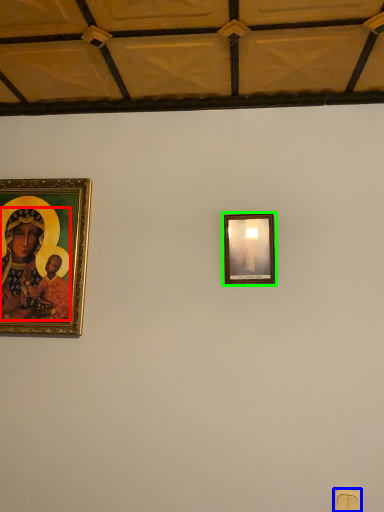
Question: Which is farther away from person (highlighted by a red box)? light switch (highlighted by a blue box) or picture frame (highlighted by a green box)?

Choices:
 (A) light switch
 (B) picture frame

Answer: (A)